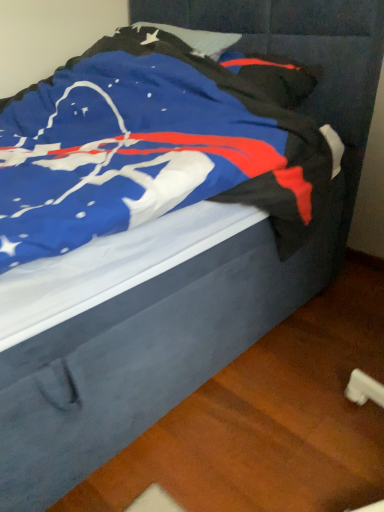
This screenshot has height=512, width=384. Find the location of `blue cotton blanket at center`. blue cotton blanket at center is located at coordinates (155, 145).

What do you see at coordinates (155, 145) in the screenshot? The height and width of the screenshot is (512, 384). I see `blue cotton blanket at center` at bounding box center [155, 145].

Where is `blue cotton blanket at center`? Image resolution: width=384 pixels, height=512 pixels. blue cotton blanket at center is located at coordinates (155, 145).